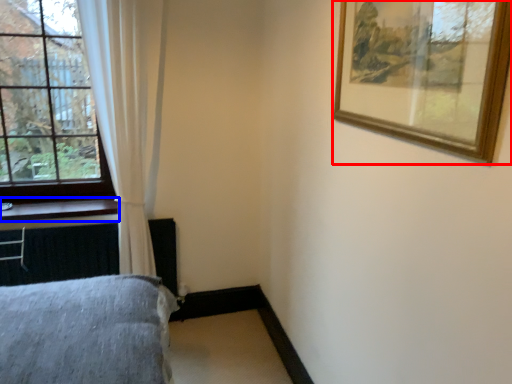
Question: Which of the following is the closest to the observer, picture frame (highlighted by a red box) or window sill (highlighted by a blue box)?

Choices:
 (A) picture frame
 (B) window sill

Answer: (A)